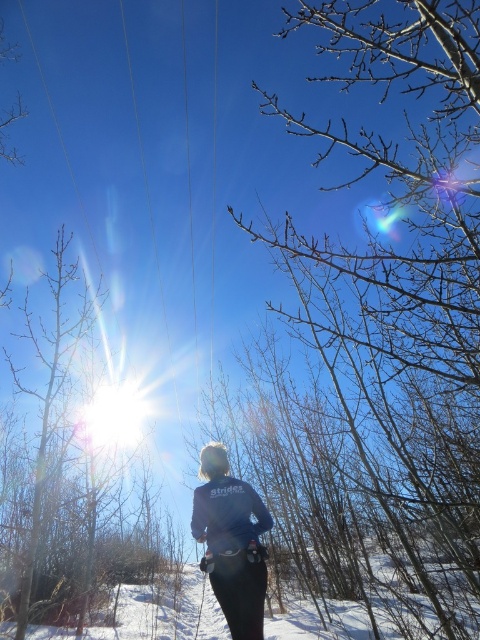
Is point (423, 458) closer to viewer compared to point (232, 522)?

That is False.

Can you confirm if bare branches at center is thinner than dark blue fleece jacket at center?

In fact, bare branches at center might be wider than dark blue fleece jacket at center.

The height and width of the screenshot is (640, 480). In order to click on bare branches at center in this screenshot , I will do `click(406, 266)`.